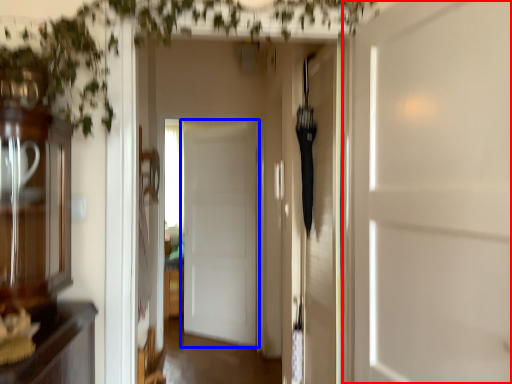
Question: Which of the following is the farthest to the observer, door (highlighted by a red box) or door (highlighted by a blue box)?

Choices:
 (A) door
 (B) door

Answer: (B)